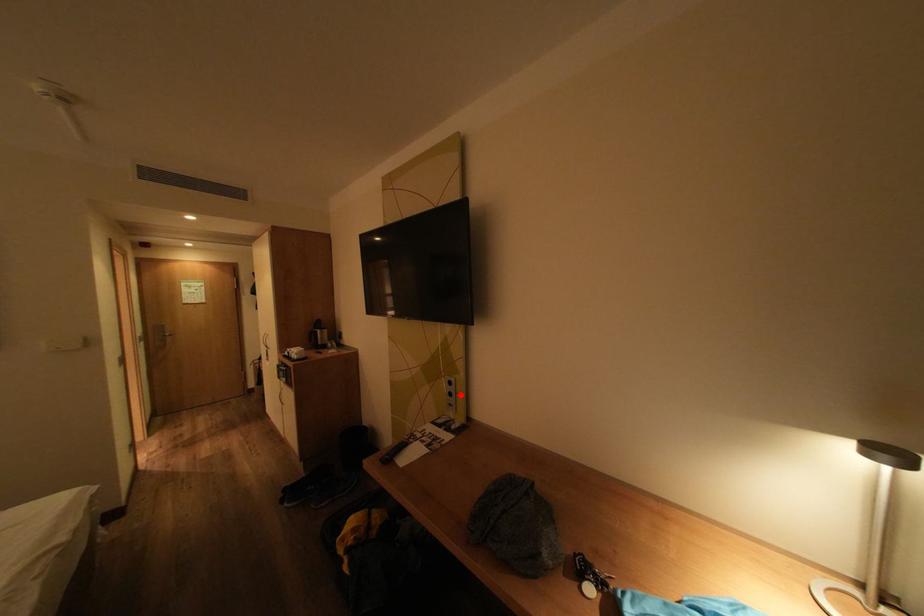
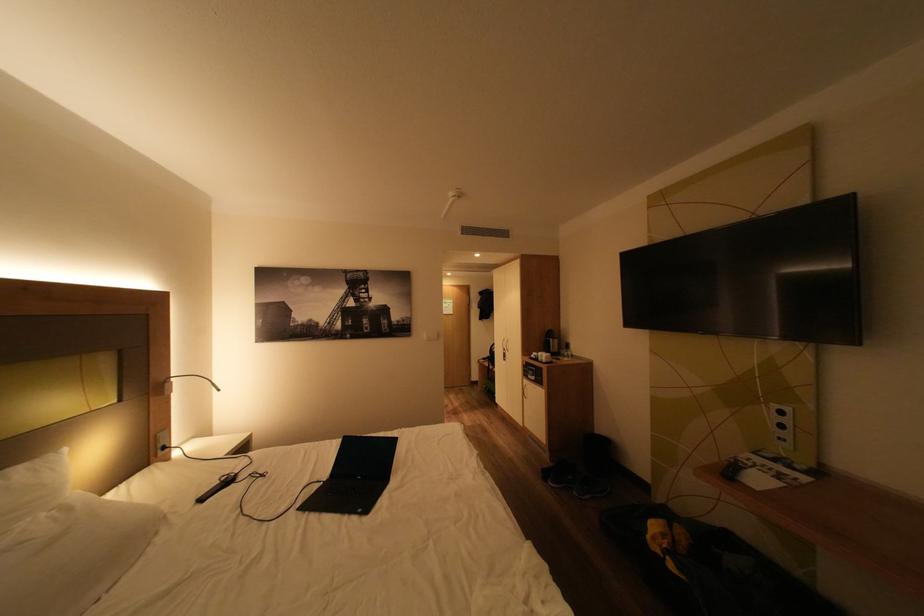
Question: A red point is marked in image1. In image2, is the corresponding 3D point closer to the camera or farther? Reply with the corresponding letter.

Choices:
 (A) The corresponding 3D point is closer.
 (B) The corresponding 3D point is farther.

Answer: (A)